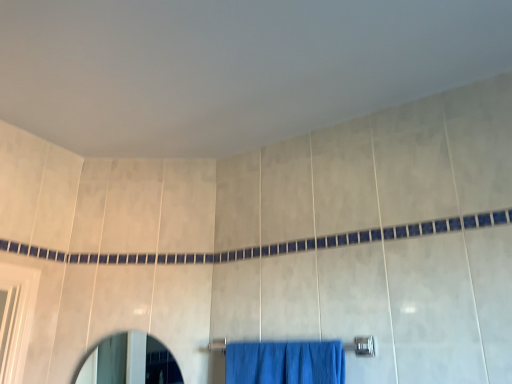
Where is `silver metallic towel bar at lower center`? The height and width of the screenshot is (384, 512). silver metallic towel bar at lower center is located at coordinates coord(362,346).

This screenshot has width=512, height=384. What do you see at coordinates (362, 346) in the screenshot? I see `silver metallic towel bar at lower center` at bounding box center [362, 346].

What is the approximate height of silver metallic towel bar at lower center?

silver metallic towel bar at lower center is 2.48 inches tall.

The height and width of the screenshot is (384, 512). Describe the element at coordinates (129, 361) in the screenshot. I see `matte glass mirror at lower left` at that location.

Locate an element on the screen. The height and width of the screenshot is (384, 512). matte glass mirror at lower left is located at coordinates (129, 361).

I want to click on silver metallic towel bar at lower center, so click(x=362, y=346).

Consider the image. Does silver metallic towel bar at lower center appear on the left side of matte glass mirror at lower left?

In fact, silver metallic towel bar at lower center is to the right of matte glass mirror at lower left.

Who is more distant, silver metallic towel bar at lower center or matte glass mirror at lower left?

matte glass mirror at lower left is further away from the camera.

Is point (356, 345) closer to viewer compared to point (106, 379)?

Yes.

In the scene shown: From the image's perspective, between silver metallic towel bar at lower center and matte glass mirror at lower left, who is located below?

matte glass mirror at lower left appears lower in the image.

From a real-world perspective, who is located higher, silver metallic towel bar at lower center or matte glass mirror at lower left?

From a 3D spatial view, silver metallic towel bar at lower center is above.

Between silver metallic towel bar at lower center and matte glass mirror at lower left, which one has smaller width?

With smaller width is matte glass mirror at lower left.

Considering the sizes of objects silver metallic towel bar at lower center and matte glass mirror at lower left in the image provided, who is shorter, silver metallic towel bar at lower center or matte glass mirror at lower left?

silver metallic towel bar at lower center.

Which of these two, silver metallic towel bar at lower center or matte glass mirror at lower left, is bigger?

With larger size is matte glass mirror at lower left.

Is silver metallic towel bar at lower center outside of matte glass mirror at lower left?

silver metallic towel bar at lower center is positioned outside matte glass mirror at lower left.

From the picture: Is silver metallic towel bar at lower center far from matte glass mirror at lower left?

silver metallic towel bar at lower center is far away from matte glass mirror at lower left.

Is silver metallic towel bar at lower center aimed at matte glass mirror at lower left?

No, silver metallic towel bar at lower center is not turned towards matte glass mirror at lower left.

The height and width of the screenshot is (384, 512). I want to click on towel bar lying on the right of matte glass mirror at lower left, so click(362, 346).

Visually, is matte glass mirror at lower left positioned to the left or to the right of silver metallic towel bar at lower center?

In the image, matte glass mirror at lower left appears on the left side of silver metallic towel bar at lower center.

Consider the image. In the image, is matte glass mirror at lower left positioned in front of or behind silver metallic towel bar at lower center?

Result: matte glass mirror at lower left is behind silver metallic towel bar at lower center.

Between point (121, 346) and point (355, 336), which one is positioned in front?

The point (355, 336) is closer.

From the image's perspective, is matte glass mirror at lower left positioned above or below silver metallic towel bar at lower center?

matte glass mirror at lower left is below silver metallic towel bar at lower center.

From a real-world perspective, is matte glass mirror at lower left physically located above or below silver metallic towel bar at lower center?

Clearly, from a real-world perspective, matte glass mirror at lower left is below silver metallic towel bar at lower center.

Between matte glass mirror at lower left and silver metallic towel bar at lower center, which one has smaller width?

With smaller width is matte glass mirror at lower left.

Between matte glass mirror at lower left and silver metallic towel bar at lower center, which one has more height?

matte glass mirror at lower left is taller.

In terms of size, does matte glass mirror at lower left appear bigger or smaller than silver metallic towel bar at lower center?

matte glass mirror at lower left is bigger than silver metallic towel bar at lower center.

Is matte glass mirror at lower left completely or partially outside of silver metallic towel bar at lower center?

That's correct, matte glass mirror at lower left is outside of silver metallic towel bar at lower center.

Is matte glass mirror at lower left far from silver metallic towel bar at lower center?

Yes, matte glass mirror at lower left is far from silver metallic towel bar at lower center.

Is matte glass mirror at lower left oriented towards silver metallic towel bar at lower center?

No, matte glass mirror at lower left is not turned towards silver metallic towel bar at lower center.

How different are the orientations of matte glass mirror at lower left and silver metallic towel bar at lower center in degrees?

There is a 34.2-degree angle between the facing directions of matte glass mirror at lower left and silver metallic towel bar at lower center.

How far apart are matte glass mirror at lower left and silver metallic towel bar at lower center?

They are 6.25 feet apart.

Locate an element on the screen. mirror located underneath the silver metallic towel bar at lower center (from a real-world perspective) is located at coordinates (129, 361).

Image resolution: width=512 pixels, height=384 pixels. What are the coordinates of `towel bar that is above the matte glass mirror at lower left (from a real-world perspective)` in the screenshot? It's located at (362, 346).

I want to click on towel bar in front of the matte glass mirror at lower left, so click(x=362, y=346).